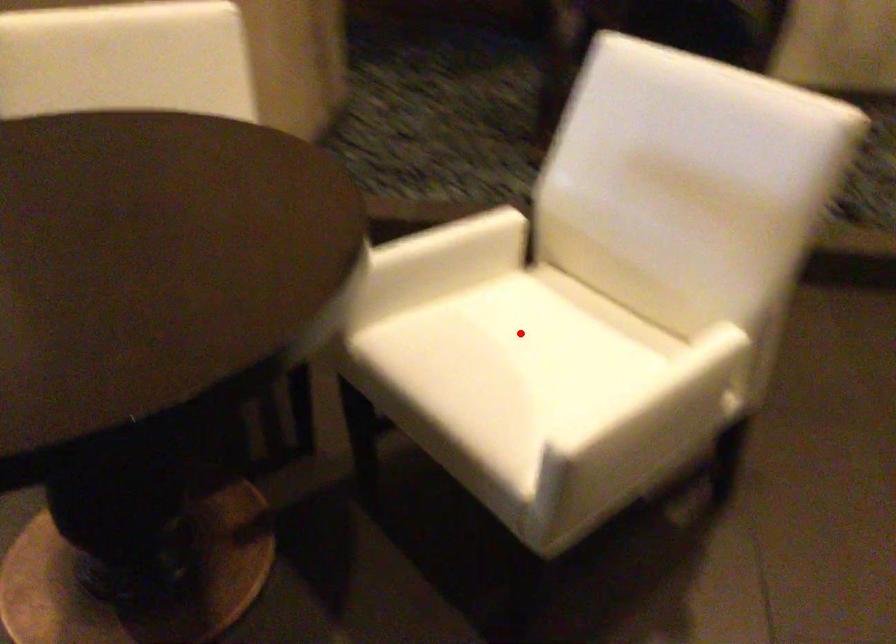
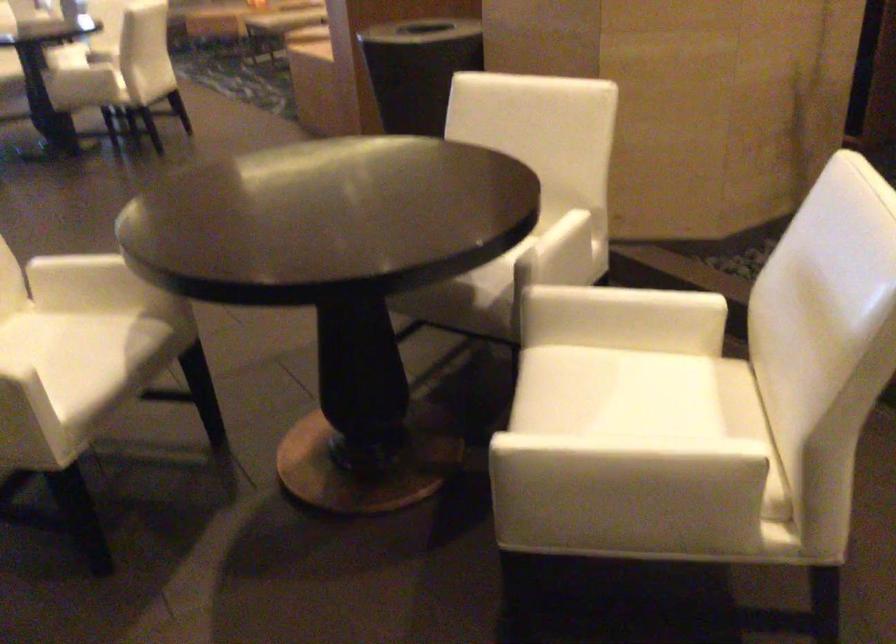
Find the pixel in the second image that matches the highlighted location in the first image.

(640, 393)